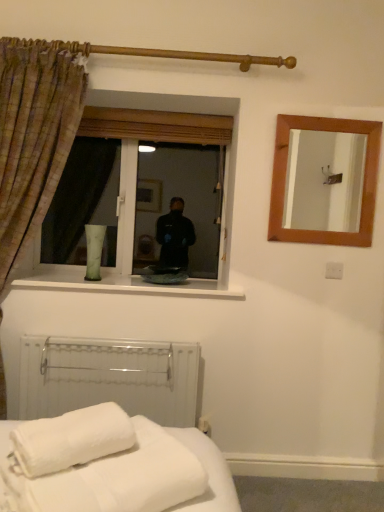
What is the approximate height of plaid fabric curtain at left?

6.24 feet.

Measure the distance between white soft towel at lower left and camera.

30.66 inches.

Locate an element on the screen. white soft towel at lower left is located at coordinates (116, 466).

The image size is (384, 512). What are the coordinates of `white plastic radiator at lower left` in the screenshot? It's located at (109, 378).

Is point (202, 132) positioned behind point (122, 358)?

That is True.

Is white plastic radiator at lower left a part of transparent glass window at center?

No, white plastic radiator at lower left is not a part of transparent glass window at center.

Which is in front, transparent glass window at center or white plastic radiator at lower left?

white plastic radiator at lower left is in front.

From the picture: In terms of size, does transparent glass window at center appear bigger or smaller than white plastic radiator at lower left?

In the image, transparent glass window at center appears to be larger than white plastic radiator at lower left.

Where is `balustrade below the white soft towel at lower left (from a real-world perspective)`? balustrade below the white soft towel at lower left (from a real-world perspective) is located at coordinates (109, 378).

Based on the photo, which object is closer to the camera, white soft towel at lower left or white plastic radiator at lower left?

white soft towel at lower left is more forward.

Is white soft towel at lower left with white plastic radiator at lower left?

There is a gap between white soft towel at lower left and white plastic radiator at lower left.

Is white soft towel at lower left not close to wooden mirror at upper right?

Indeed, white soft towel at lower left is not near wooden mirror at upper right.

Where is `bed that appears in front of the wooden mirror at upper right`? The height and width of the screenshot is (512, 384). bed that appears in front of the wooden mirror at upper right is located at coordinates (116, 466).

From a real-world perspective, which object stands above the other?

From a 3D spatial view, wooden mirror at upper right is above.

Does white soft towel at lower left contain wooden mirror at upper right?

No, wooden mirror at upper right is not surrounded by white soft towel at lower left.

Identify the location of bed in front of the white plastic radiator at lower left. tap(116, 466).

From the image's perspective, does white plastic radiator at lower left appear higher than white soft towel at lower left?

No, from the image's perspective, white plastic radiator at lower left is not above white soft towel at lower left.

Looking at this image, could you tell me if white plastic radiator at lower left is facing white soft towel at lower left?

Yes, white plastic radiator at lower left is aimed at white soft towel at lower left.

Considering the positions of objects white plastic radiator at lower left and white soft towel at lower left in the image provided, who is in front, white plastic radiator at lower left or white soft towel at lower left?

Positioned in front is white soft towel at lower left.

From a real-world perspective, which object stands above the other?

From a 3D spatial view, transparent glass window at center is above.

Considering the positions of objects plaid fabric curtain at left and transparent glass window at center in the image provided, who is more to the left, plaid fabric curtain at left or transparent glass window at center?

plaid fabric curtain at left is more to the left.

Between plaid fabric curtain at left and transparent glass window at center, which one is positioned in front?

plaid fabric curtain at left is closer to the camera.

From the image's perspective, which is above, plaid fabric curtain at left or transparent glass window at center?

transparent glass window at center appears higher in the image.

Image resolution: width=384 pixels, height=512 pixels. I want to click on curtain above the white plastic radiator at lower left (from the image's perspective), so click(34, 133).

What's the angular difference between plaid fabric curtain at left and white plastic radiator at lower left's facing directions?

The angle between the facing direction of plaid fabric curtain at left and the facing direction of white plastic radiator at lower left is 0.634 degrees.

Visually, is plaid fabric curtain at left positioned to the left or to the right of white plastic radiator at lower left?

plaid fabric curtain at left is positioned on white plastic radiator at lower left's left side.

Is point (85, 86) less distant than point (63, 396)?

That is True.

Is point (165, 481) positioned before point (32, 86)?

That is True.

Which object is more forward, white soft towel at lower left or plaid fabric curtain at left?

white soft towel at lower left is closer to the camera.

Is white soft towel at lower left to the left or to the right of plaid fabric curtain at left in the image?

In the image, white soft towel at lower left appears on the right side of plaid fabric curtain at left.

Can you tell me how much white soft towel at lower left and plaid fabric curtain at left differ in facing direction?

124 degrees separate the facing orientations of white soft towel at lower left and plaid fabric curtain at left.

At what (x,y) coordinates should I click in order to perform the action: click on balustrade below the transparent glass window at center (from the image's perspective). Please return your answer as a coordinate pair (x, y). Looking at the image, I should click on (109, 378).

Image resolution: width=384 pixels, height=512 pixels. I want to click on bed that appears in front of the white plastic radiator at lower left, so click(116, 466).

Looking at the image, which one is located closer to wooden mirror at upper right, white soft towel at lower left or transparent glass window at center?

Based on the image, transparent glass window at center appears to be nearer to wooden mirror at upper right.

Estimate the real-world distances between objects in this image. Which object is further from wooden mirror at upper right, plaid fabric curtain at left or white soft towel at lower left?

white soft towel at lower left lies further to wooden mirror at upper right than the other object.

Looking at the image, which one is located further to plaid fabric curtain at left, white plastic radiator at lower left or transparent glass window at center?

white plastic radiator at lower left is positioned further to the anchor plaid fabric curtain at left.

Looking at the image, which one is located closer to transparent glass window at center, white soft towel at lower left or white plastic radiator at lower left?

white plastic radiator at lower left.

Estimate the real-world distances between objects in this image. Which object is further from white soft towel at lower left, white plastic radiator at lower left or transparent glass window at center?

Among the two, transparent glass window at center is located further to white soft towel at lower left.

Estimate the real-world distances between objects in this image. Which object is closer to plaid fabric curtain at left, wooden mirror at upper right or transparent glass window at center?

transparent glass window at center lies closer to plaid fabric curtain at left than the other object.

Considering their positions, is plaid fabric curtain at left positioned closer to wooden mirror at upper right than transparent glass window at center?

Among the two, transparent glass window at center is located nearer to wooden mirror at upper right.

From the image, which object appears to be nearer to wooden mirror at upper right, plaid fabric curtain at left or white plastic radiator at lower left?

The object closer to wooden mirror at upper right is white plastic radiator at lower left.

This screenshot has width=384, height=512. What are the coordinates of `balustrade between white soft towel at lower left and transparent glass window at center along the z-axis` in the screenshot? It's located at (109, 378).

Where is `mirror between transparent glass window at center and white plastic radiator at lower left in the up-down direction`? Image resolution: width=384 pixels, height=512 pixels. mirror between transparent glass window at center and white plastic radiator at lower left in the up-down direction is located at coordinates (324, 181).

This screenshot has width=384, height=512. I want to click on curtain located between white soft towel at lower left and transparent glass window at center in the depth direction, so click(34, 133).

This screenshot has height=512, width=384. Find the location of `curtain between white soft towel at lower left and white plastic radiator at lower left in the front-back direction`. curtain between white soft towel at lower left and white plastic radiator at lower left in the front-back direction is located at coordinates point(34,133).